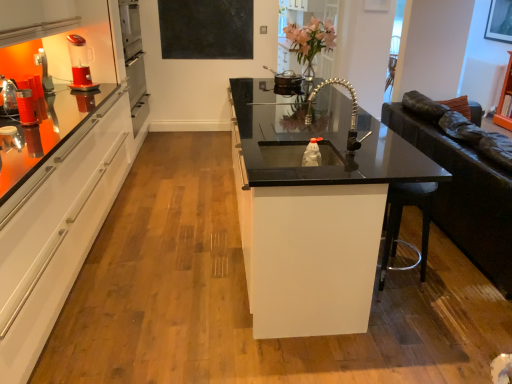
Looking at this image, what is the approximate width of black glass countertop at center?

The width of black glass countertop at center is 95.79 centimeters.

This screenshot has width=512, height=384. What do you see at coordinates (26, 107) in the screenshot?
I see `matte plastic cup at left, which ranks as the 2th appliance in top-to-bottom order` at bounding box center [26, 107].

What do you see at coordinates (80, 64) in the screenshot? I see `red plastic blender at upper left` at bounding box center [80, 64].

Identify the location of black matte board at upper center. (206, 29).

Image resolution: width=512 pixels, height=384 pixels. Describe the element at coordinates (500, 21) in the screenshot. I see `matte black picture frame at upper right` at that location.

Where is `black glass countertop at center`? The width and height of the screenshot is (512, 384). black glass countertop at center is located at coordinates (312, 207).

Does black matte board at upper center lie behind matte black picture frame at upper right?

No, black matte board at upper center is in front of matte black picture frame at upper right.

Which of these two, black matte board at upper center or matte black picture frame at upper right, is smaller?

Smaller between the two is matte black picture frame at upper right.

Is point (252, 44) positioned before point (493, 6)?

No, (252, 44) is further to viewer.

Can you confirm if black matte board at upper center is wider than matte black picture frame at upper right?

Yes.

Is pink glass vase at upper center placed right next to red plastic blender at upper left?

No.

Does pink glass vase at upper center appear on the left side of red plastic blender at upper left?

In fact, pink glass vase at upper center is to the right of red plastic blender at upper left.

Is pink glass vase at upper center shorter than red plastic blender at upper left?

In fact, pink glass vase at upper center may be taller than red plastic blender at upper left.

Is red plastic blender at upper left at the left side of matte plastic cup at left, arranged as the second appliance when viewed from the right?

Indeed, red plastic blender at upper left is positioned on the left side of matte plastic cup at left, arranged as the second appliance when viewed from the right.

Is red plastic blender at upper left looking in the opposite direction of matte plastic cup at left, arranged as the second appliance when viewed from the right?

red plastic blender at upper left does not have its back to matte plastic cup at left, arranged as the second appliance when viewed from the right.

Is red plastic blender at upper left positioned before matte plastic cup at left, the 2th appliance from the back?

No, red plastic blender at upper left is further to the viewer.

Can matte plastic cup at left, arranged as the second appliance when viewed from the right, be found inside red plastic blender at upper left?

Definitely not — matte plastic cup at left, arranged as the second appliance when viewed from the right, is not inside red plastic blender at upper left.

Can metallic silver pot at upper center, the first appliance in the right-to-left sequence, be found inside black matte board at upper center?

No, black matte board at upper center does not contain metallic silver pot at upper center, the first appliance in the right-to-left sequence.

Is point (191, 22) farther from camera compared to point (288, 89)?

Yes, point (191, 22) is farther from viewer.

From a real-world perspective, which is physically above, black matte board at upper center or metallic silver pot at upper center, the first appliance in the right-to-left sequence?

In real-world perspective, black matte board at upper center is above.

Is red plastic blender at upper left at the back of matte black picture frame at upper right?

matte black picture frame at upper right does not have its back to red plastic blender at upper left.

Based on the photo, is matte black picture frame at upper right next to red plastic blender at upper left?

There is a gap between matte black picture frame at upper right and red plastic blender at upper left.

In the scene shown: From a real-world perspective, is matte black picture frame at upper right under red plastic blender at upper left?

Incorrect, from a real-world perspective, matte black picture frame at upper right is higher than red plastic blender at upper left.

From the image's perspective, is matte black picture frame at upper right above red plastic blender at upper left?

Indeed, from the image's perspective, matte black picture frame at upper right is shown above red plastic blender at upper left.

Between pink glass vase at upper center and matte plastic cup at left, the 2th appliance from the back, which one has larger size?

pink glass vase at upper center is bigger.

Is pink glass vase at upper center touching matte plastic cup at left, arranged as the second appliance when viewed from the right?

pink glass vase at upper center and matte plastic cup at left, arranged as the second appliance when viewed from the right, are not in contact.

Locate an element on the screen. This screenshot has width=512, height=384. appliance that is the 1st one below the pink glass vase at upper center (from a real-world perspective) is located at coordinates (26, 107).

Based on the photo, how many degrees apart are the facing directions of pink glass vase at upper center and matte plastic cup at left, which is the 1th appliance in front-to-back order?

There is a 6.45-degree angle between the facing directions of pink glass vase at upper center and matte plastic cup at left, which is the 1th appliance in front-to-back order.

Considering the positions of objects metallic silver pot at upper center, which ranks as the 1th appliance in back-to-front order, and black glass countertop at center in the image provided, who is more to the left, metallic silver pot at upper center, which ranks as the 1th appliance in back-to-front order, or black glass countertop at center?

metallic silver pot at upper center, which ranks as the 1th appliance in back-to-front order.

Is metallic silver pot at upper center, the second appliance positioned from the bottom, smaller than black glass countertop at center?

Yes, metallic silver pot at upper center, the second appliance positioned from the bottom, is smaller than black glass countertop at center.

Does point (274, 91) come closer to viewer compared to point (358, 195)?

No, it is not.

This screenshot has width=512, height=384. I want to click on countertop that is on the right side of metallic silver pot at upper center, the second appliance positioned from the bottom, so click(x=312, y=207).

Locate an element on the screen. bulletin board below the matte black picture frame at upper right (from the image's perspective) is located at coordinates (206, 29).

The height and width of the screenshot is (384, 512). I want to click on coffee machine that appears below the pink glass vase at upper center (from a real-world perspective), so click(80, 64).

Considering their positions, is black glass countertop at center positioned closer to red plastic blender at upper left than pink glass vase at upper center?

pink glass vase at upper center is positioned closer to the anchor red plastic blender at upper left.

From the image, which object appears to be farther from pink glass vase at upper center, matte black picture frame at upper right or matte plastic cup at left, arranged as the second appliance when viewed from the right?

Among the two, matte plastic cup at left, arranged as the second appliance when viewed from the right, is located further to pink glass vase at upper center.

Based on the photo, which object lies further to the anchor point matte black picture frame at upper right, metallic silver pot at upper center, the second appliance positioned from the bottom, or black glass countertop at center?

black glass countertop at center lies further to matte black picture frame at upper right than the other object.

Looking at the image, which one is located further to matte black picture frame at upper right, red plastic blender at upper left or matte plastic cup at left, the 2th appliance from the back?

The object further to matte black picture frame at upper right is matte plastic cup at left, the 2th appliance from the back.

Considering their positions, is metallic silver pot at upper center, the second appliance positioned from the bottom, positioned further to pink glass vase at upper center than red plastic blender at upper left?

red plastic blender at upper left is positioned further to the anchor pink glass vase at upper center.

Which object lies nearer to the anchor point black matte board at upper center, black glass countertop at center or pink glass vase at upper center?

pink glass vase at upper center is closer to black matte board at upper center.

Which object lies nearer to the anchor point matte plastic cup at left, which is the 1th appliance in front-to-back order, metallic silver pot at upper center, the first appliance in the right-to-left sequence, or red plastic blender at upper left?

red plastic blender at upper left lies closer to matte plastic cup at left, which is the 1th appliance in front-to-back order, than the other object.

Looking at the image, which one is located further to pink glass vase at upper center, matte black picture frame at upper right or black matte board at upper center?

matte black picture frame at upper right.

Find the location of a particular element. This screenshot has height=384, width=512. flower positioned between metallic silver pot at upper center, which ranks as the 1th appliance in back-to-front order, and black matte board at upper center from near to far is located at coordinates (310, 39).

You are a GUI agent. You are given a task and a screenshot of the screen. Output one action in this format:
    pyautogui.click(x=<x>, y=<y>)
    Task: Click on the appliance between matte plastic cup at left, the 2th appliance from the back, and black glass countertop at center, in the horizontal direction
    The height and width of the screenshot is (384, 512).
    Given the screenshot: What is the action you would take?
    pyautogui.click(x=286, y=82)

Where is `countertop located between red plastic blender at upper left and pink glass vase at upper center in the left-right direction`? countertop located between red plastic blender at upper left and pink glass vase at upper center in the left-right direction is located at coordinates (312, 207).

Identify the location of countertop between black matte board at upper center and matte black picture frame at upper right. (312, 207).